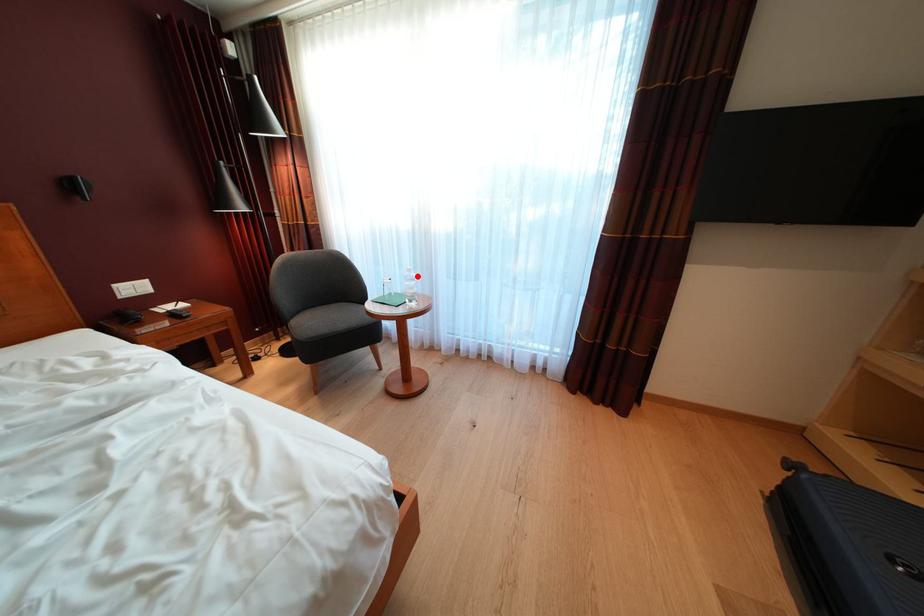
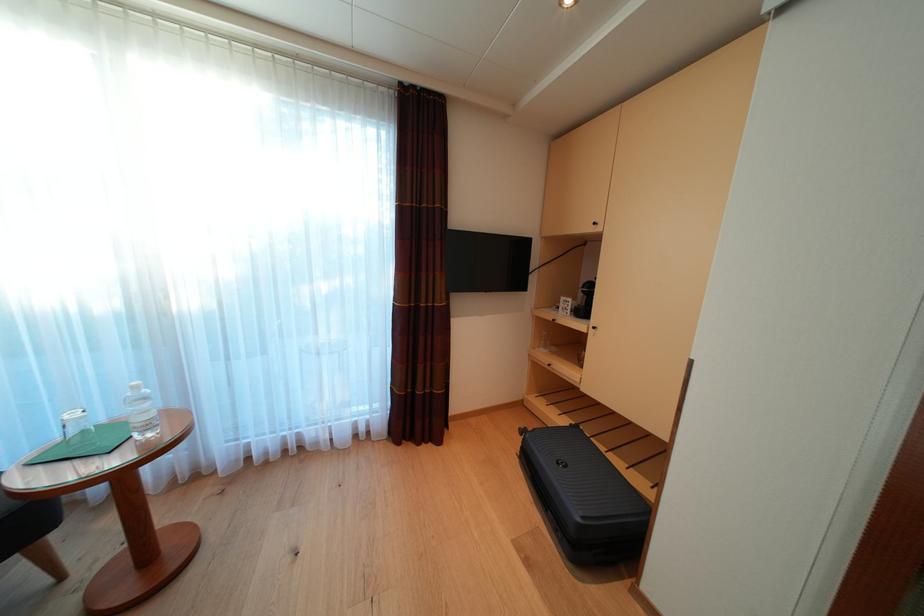
Question: I am providing you with two images of the same scene from different viewpoints. Given a red point in image1, look at the same physical point in image2. Is it:

Choices:
 (A) Closer to the viewpoint
 (B) Farther from the viewpoint

Answer: (B)